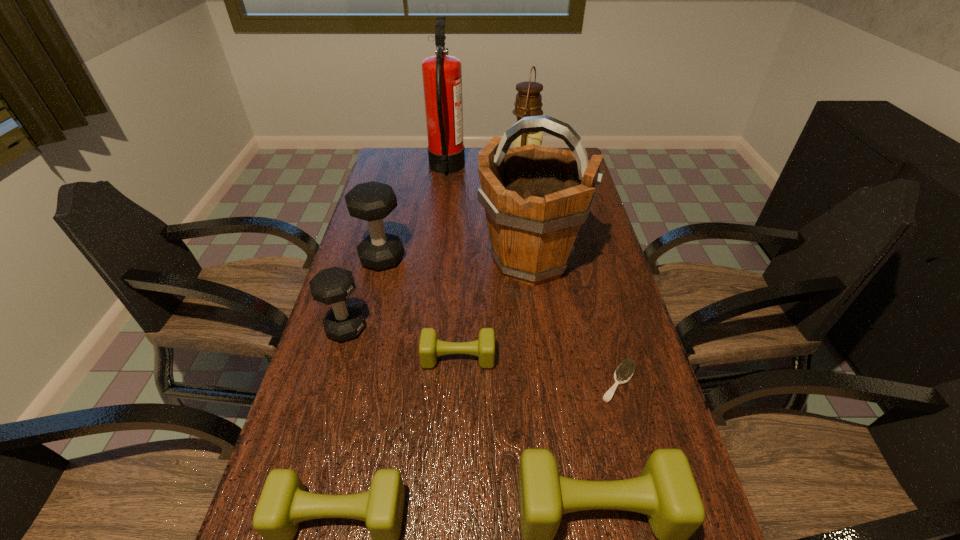
Identify the location of the sixth closest object relative to the red fire extinguisher. (624, 372).

Where is `the fourth closest dumbbell to the third shortest object`? The width and height of the screenshot is (960, 540). the fourth closest dumbbell to the third shortest object is located at coordinates (372, 201).

I want to click on the second closest dumbbell to the fourth shortest object, so click(430, 348).

At what (x,y) coordinates should I click in order to perform the action: click on the closest olive dumbbell to the biggest olive dumbbell. Please return your answer as a coordinate pair (x, y). Looking at the image, I should click on (284, 503).

Identify the location of the third closest olive dumbbell to the scrubbing brush. The width and height of the screenshot is (960, 540). (284, 503).